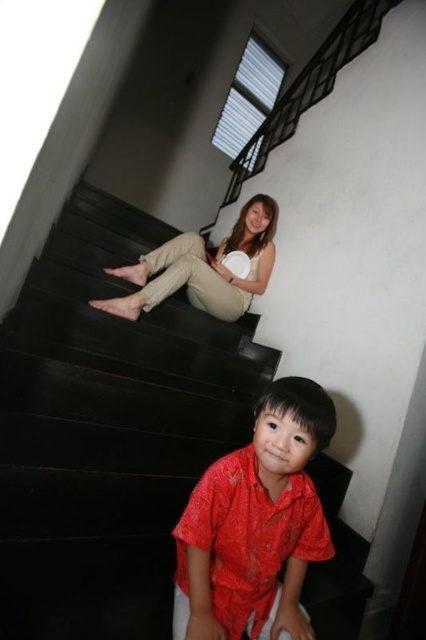
You are a photographer setting up a shoot in this staircase scene. You need to ensure that the matte red shirt at lower center and the beige cotton pants at center are both visible in the frame. Considering their widths, which object should you focus on to ensure both are fully captured?

The matte red shirt at lower center has a smaller width than the beige cotton pants at center. To ensure both are fully captured, focus on the beige cotton pants at center since it is wider and requires more space in the frame.

You are standing at the bottom of the staircase and want to take a photo of the black glossy stairs at upper center and the beige cotton pants at center. Which object should you focus on first to ensure both are in focus?

The black glossy stairs at upper center is closer to the viewer than the beige cotton pants at center, so you should focus on the black glossy stairs at upper center first to ensure both are in focus.

You are standing at the bottom of the staircase and want to place a small potted plant on the step where the matte red shirt at lower center is currently sitting. Is there enough space for both the child and the plant?

The matte red shirt at lower center is located at point (256, 524), which indicates the child is sitting near the center of the step. There might not be enough space for the plant without disturbing the child.